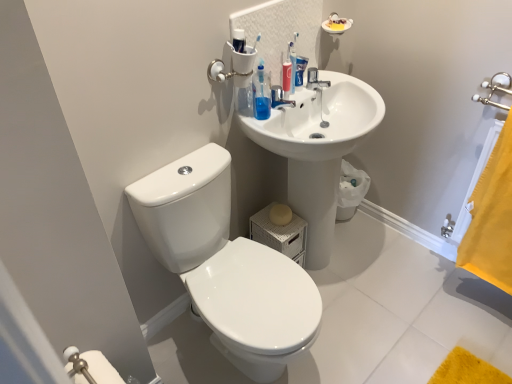
Question: Does point (501, 140) appear closer or farther from the camera than point (309, 244)?

Choices:
 (A) farther
 (B) closer

Answer: (B)

Question: From their relative heights in the image, would you say yellow fabric towel at right is taller or shorter than white glossy sink at upper right?

Choices:
 (A) short
 (B) tall

Answer: (A)

Question: Estimate the real-world distances between objects in this image. Which object is closer to the blue matte toothpaste tube at upper center?

Choices:
 (A) white glossy sink at upper right
 (B) yellow fabric towel at right
 (C) white glossy toilet at lower left
 (D) metallic silver faucet at upper center

Answer: (D)

Question: Which is farther from the yellow fabric towel at right?

Choices:
 (A) white glossy sink at upper right
 (B) blue matte toothpaste tube at upper center
 (C) metallic silver faucet at upper center
 (D) white glossy toilet at lower left

Answer: (D)